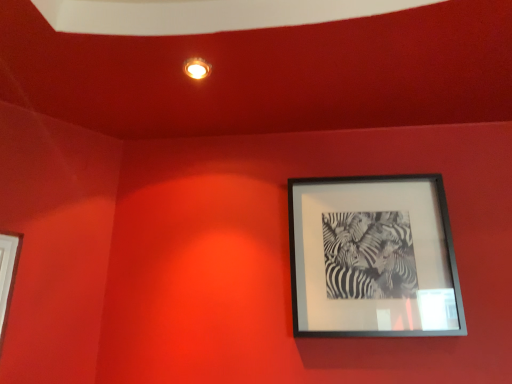
Where is `black matte picture frame at upper right`? black matte picture frame at upper right is located at coordinates (373, 258).

The height and width of the screenshot is (384, 512). Describe the element at coordinates (373, 258) in the screenshot. I see `black matte picture frame at upper right` at that location.

What is the approximate height of black matte picture frame at upper right?

21.42 inches.

Locate an element on the screen. This screenshot has height=384, width=512. black matte picture frame at upper right is located at coordinates (373, 258).